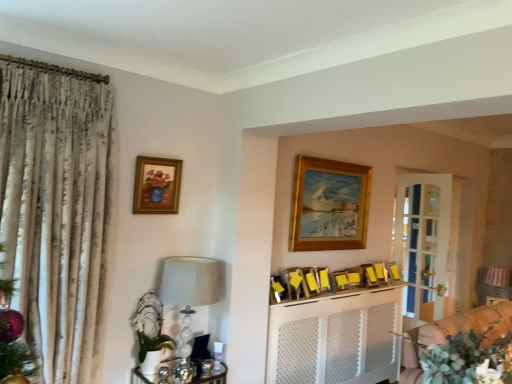
Question: Could white perforated cabinet at center be considered to be inside wooden picture frame at center, marked as the seventh picture frame in a left-to-right arrangement?

Choices:
 (A) yes
 (B) no

Answer: (B)

Question: Is wooden picture frame at center, placed as the 3th picture frame when sorted from right to left, oriented towards white perforated cabinet at center?

Choices:
 (A) no
 (B) yes

Answer: (A)

Question: Does wooden picture frame at center, placed as the 3th picture frame when sorted from right to left, have a lesser height compared to white perforated cabinet at center?

Choices:
 (A) no
 (B) yes

Answer: (B)

Question: Is wooden picture frame at center, placed as the 3th picture frame when sorted from right to left, to the left of white perforated cabinet at center from the viewer's perspective?

Choices:
 (A) no
 (B) yes

Answer: (A)

Question: Is wooden picture frame at center, marked as the seventh picture frame in a left-to-right arrangement, smaller than white perforated cabinet at center?

Choices:
 (A) yes
 (B) no

Answer: (A)

Question: Considering the relative positions of wooden frame with floral painting at upper left, the ninth picture frame viewed from the right, and white perforated cabinet at center in the image provided, is wooden frame with floral painting at upper left, the ninth picture frame viewed from the right, to the left or to the right of white perforated cabinet at center?

Choices:
 (A) left
 (B) right

Answer: (A)

Question: Considering their positions, is wooden frame with floral painting at upper left, the 1th picture frame positioned from the left, located in front of or behind white perforated cabinet at center?

Choices:
 (A) front
 (B) behind

Answer: (A)

Question: From the image's perspective, is wooden frame with floral painting at upper left, the 1th picture frame positioned from the left, above or below white perforated cabinet at center?

Choices:
 (A) above
 (B) below

Answer: (A)

Question: Considering the positions of wooden frame with floral painting at upper left, the ninth picture frame viewed from the right, and white perforated cabinet at center in the image, is wooden frame with floral painting at upper left, the ninth picture frame viewed from the right, wider or thinner than white perforated cabinet at center?

Choices:
 (A) thin
 (B) wide

Answer: (A)

Question: From the image's perspective, is gold wooden picture frame at upper center, which is the fifth picture frame from left to right, located above or below white textured cabinet at center, placed as the 2th furniture when sorted from right to left?

Choices:
 (A) above
 (B) below

Answer: (A)

Question: Is gold wooden picture frame at upper center, which is the fifth picture frame in right-to-left order, inside or outside of white textured cabinet at center, placed as the 2th furniture when sorted from right to left?

Choices:
 (A) outside
 (B) inside

Answer: (A)

Question: Is point (297, 173) closer or farther from the camera than point (487, 319)?

Choices:
 (A) farther
 (B) closer

Answer: (A)

Question: In the image, is gold wooden picture frame at upper center, which is the fifth picture frame from left to right, on the left side or the right side of white textured cabinet at center, acting as the 1th furniture starting from the front?

Choices:
 (A) right
 (B) left

Answer: (B)

Question: Is wooden picture frame at upper center, the 2th picture frame positioned from the right, inside the boundaries of striped fabric cushion at right, which is the third furniture in left-to-right order, or outside?

Choices:
 (A) inside
 (B) outside

Answer: (B)

Question: Is wooden picture frame at upper center, the 2th picture frame positioned from the right, taller or shorter than striped fabric cushion at right, the first furniture positioned from the back?

Choices:
 (A) tall
 (B) short

Answer: (B)